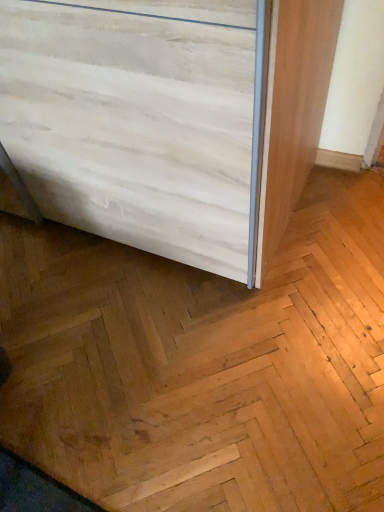
Find the location of `natural wood plywood at center`. natural wood plywood at center is located at coordinates (203, 365).

Measure the distance between natural wood plywood at center and camera.

A distance of 35.69 inches exists between natural wood plywood at center and camera.

What is the approximate width of natural wood plywood at center?

4.69 feet.

This screenshot has width=384, height=512. Describe the element at coordinates (203, 365) in the screenshot. I see `natural wood plywood at center` at that location.

You are a GUI agent. You are given a task and a screenshot of the screen. Output one action in this format:
    pyautogui.click(x=<x>, y=<y>)
    Task: Click on the natural wood plywood at center
    This screenshot has height=512, width=384.
    Given the screenshot: What is the action you would take?
    pyautogui.click(x=203, y=365)